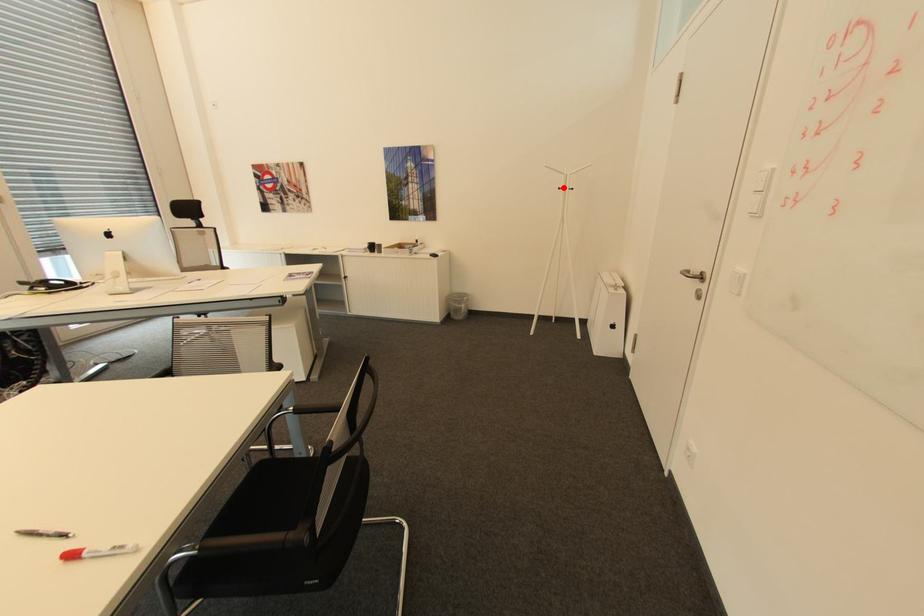
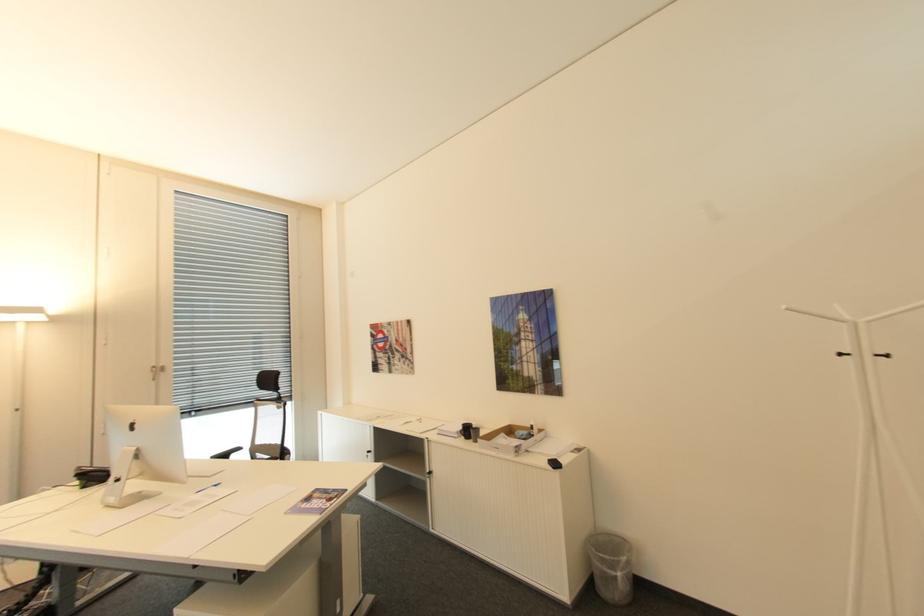
The point at the highlighted location is marked in the first image. Where is the corresponding point in the second image?

(846, 355)